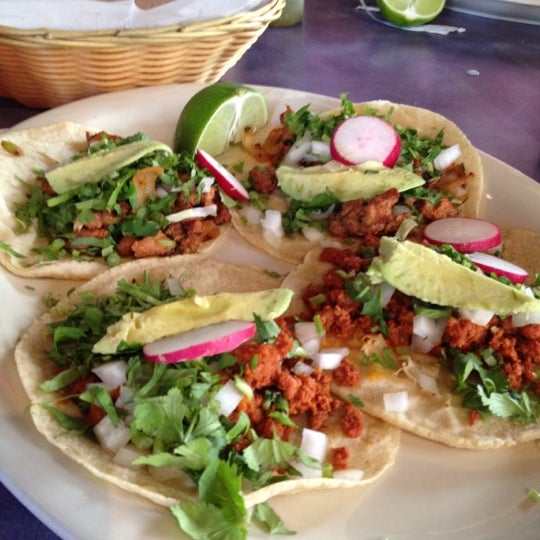
The width and height of the screenshot is (540, 540). I want to click on table, so click(22, 521), click(357, 65), click(18, 109).